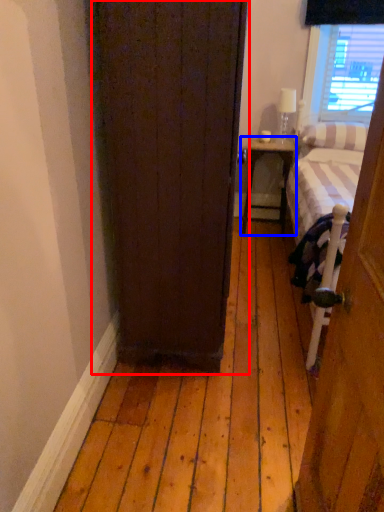
Question: Which of the following is the farthest to the observer, door (highlighted by a red box) or nightstand (highlighted by a blue box)?

Choices:
 (A) door
 (B) nightstand

Answer: (B)